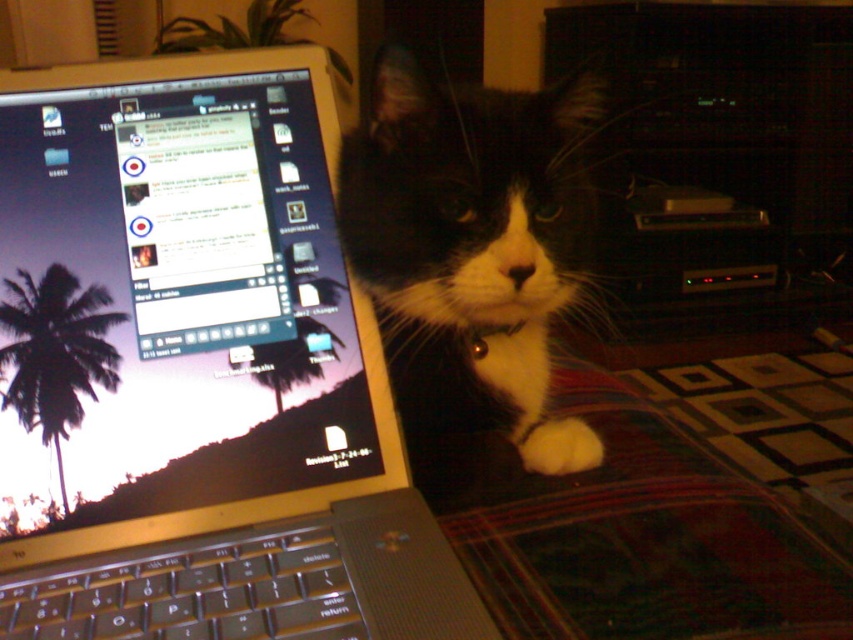
You are a delivery robot trying to reach the silver metallic laptop at center without disturbing the black fur cat at center. Based on their positions, which direction should you move towards to get closer to the laptop?

The silver metallic laptop at center is to the left of the black fur cat at center, so you should move towards the left side to get closer to the silver metallic laptop at center without disturbing the black fur cat at center.

You are a robotic vacuum cleaner with a diameter of 12 inches. You need to move from the black fur cat at center to the white fluffy paw at lower right. Can you pass through the space between them without hitting either?

The distance between the black fur cat at center and the white fluffy paw at lower right is 5.38 inches. Since your vacuum cleaner has a diameter of 12 inches, which is larger than the 5.38 inches gap, you cannot pass through the space between them without hitting either.

You are a delivery robot trying to reach the laptop screen in the scene. There is a black fur cat at center and a white fluffy paw at lower right in your way. Which object should you avoid to reach the laptop screen?

The black fur cat at center is in front of white fluffy paw at lower right, so you should avoid the black fur cat at center to reach the laptop screen.